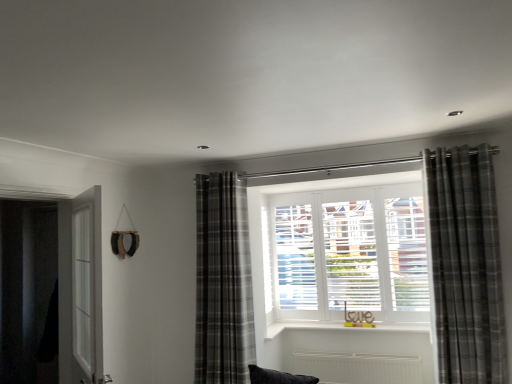
Question: Should I look upward or downward to see gray plaid curtain at center, positioned as the second curtain in right-to-left order?

Choices:
 (A) up
 (B) down

Answer: (B)

Question: Is gray plaid curtain at center, placed as the 1th curtain when sorted from left to right, located within clear glass screen door at left?

Choices:
 (A) yes
 (B) no

Answer: (B)

Question: Is clear glass screen door at left positioned before gray plaid curtain at center, the 2th curtain in the front-to-back sequence?

Choices:
 (A) no
 (B) yes

Answer: (B)

Question: Is clear glass screen door at left completely or partially outside of gray plaid curtain at center, positioned as the second curtain in right-to-left order?

Choices:
 (A) no
 (B) yes

Answer: (B)

Question: Considering the relative sizes of clear glass screen door at left and gray plaid curtain at center, placed as the 1th curtain when sorted from left to right, in the image provided, is clear glass screen door at left shorter than gray plaid curtain at center, placed as the 1th curtain when sorted from left to right,?

Choices:
 (A) no
 (B) yes

Answer: (B)

Question: Is clear glass screen door at left to the right of gray plaid curtain at center, positioned as the second curtain in right-to-left order, from the viewer's perspective?

Choices:
 (A) no
 (B) yes

Answer: (A)

Question: Can you confirm if clear glass screen door at left is smaller than gray plaid curtain at center, the 2th curtain in the front-to-back sequence?

Choices:
 (A) yes
 (B) no

Answer: (A)

Question: Is gray plaid curtain at center, placed as the 1th curtain when sorted from left to right, surrounding black matte door at left?

Choices:
 (A) no
 (B) yes

Answer: (A)

Question: Considering the relative sizes of gray plaid curtain at center, placed as the 1th curtain when sorted from left to right, and black matte door at left in the image provided, is gray plaid curtain at center, placed as the 1th curtain when sorted from left to right, wider than black matte door at left?

Choices:
 (A) yes
 (B) no

Answer: (A)

Question: Are gray plaid curtain at center, placed as the 1th curtain when sorted from left to right, and black matte door at left located far from each other?

Choices:
 (A) yes
 (B) no

Answer: (A)

Question: Considering the relative sizes of gray plaid curtain at center, the 2th curtain in the front-to-back sequence, and black matte door at left in the image provided, is gray plaid curtain at center, the 2th curtain in the front-to-back sequence, thinner than black matte door at left?

Choices:
 (A) yes
 (B) no

Answer: (B)

Question: Is gray plaid curtain at center, which ranks as the 1th curtain in back-to-front order, shorter than black matte door at left?

Choices:
 (A) no
 (B) yes

Answer: (A)

Question: From a real-world perspective, does gray plaid curtain at center, which ranks as the 1th curtain in back-to-front order, stand above black matte door at left?

Choices:
 (A) no
 (B) yes

Answer: (A)

Question: Is gray plaid curtain at right, which ranks as the 1th curtain in right-to-left order, in front of black matte door at left?

Choices:
 (A) no
 (B) yes

Answer: (A)